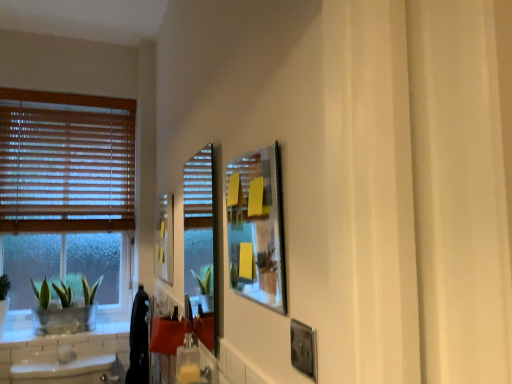
Question: In the image, is matte yellow picture frame at upper left, which is counted as the third picture frame, starting from the front, positioned in front of or behind black fabric laundry at lower left?

Choices:
 (A) behind
 (B) front

Answer: (B)

Question: Do you think matte yellow picture frame at upper left, which is counted as the third picture frame, starting from the front, is within black fabric laundry at lower left, or outside of it?

Choices:
 (A) inside
 (B) outside

Answer: (B)

Question: Estimate the real-world distances between objects in this image. Which object is farther from the metallic silver picture frame at upper center, acting as the second picture frame starting from the back?

Choices:
 (A) clear glass screen door at center
 (B) wooden blinds at left
 (C) metallic silver picture frame at lower right, the 3th picture frame viewed from the back
 (D) black fabric laundry at lower left
 (E) green leafy plant in clear glass pot at left

Answer: (B)

Question: Based on their relative distances, which object is nearer to the wooden blinds at left?

Choices:
 (A) metallic silver picture frame at upper center, the second picture frame when ordered from left to right
 (B) metallic silver picture frame at lower right, the 1th picture frame from the right
 (C) green leafy plant in clear glass pot at left
 (D) matte yellow picture frame at upper left, which is counted as the third picture frame, starting from the front
 (E) clear glass screen door at center

Answer: (C)